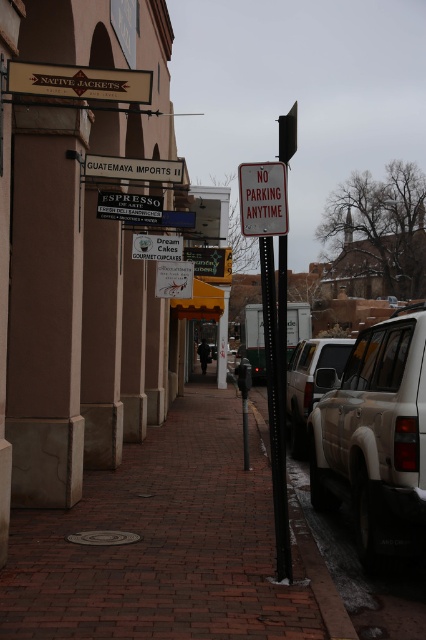
Which is more to the left, brick pavement at center or matte white suv at center?

brick pavement at center

Is the position of brick pavement at center more distant than that of matte white suv at center?

That is False.

Does point (115, 628) come farther from viewer compared to point (299, 412)?

No, (115, 628) is closer to viewer.

Locate an element on the screen. The image size is (426, 640). brick pavement at center is located at coordinates (170, 545).

Which is more to the left, matte white suv at center or black metal pole at lower center?

Positioned to the left is black metal pole at lower center.

Who is positioned more to the right, matte white suv at center or black metal pole at lower center?

matte white suv at center

Locate an element on the screen. matte white suv at center is located at coordinates (310, 381).

Does brick pavement at center come in front of metallic sign at center?

Yes.

Does point (115, 566) come closer to viewer compared to point (247, 456)?

Yes.

The image size is (426, 640). What are the coordinates of `brick pavement at center` in the screenshot? It's located at (170, 545).

In order to click on brick pavement at center in this screenshot , I will do `click(170, 545)`.